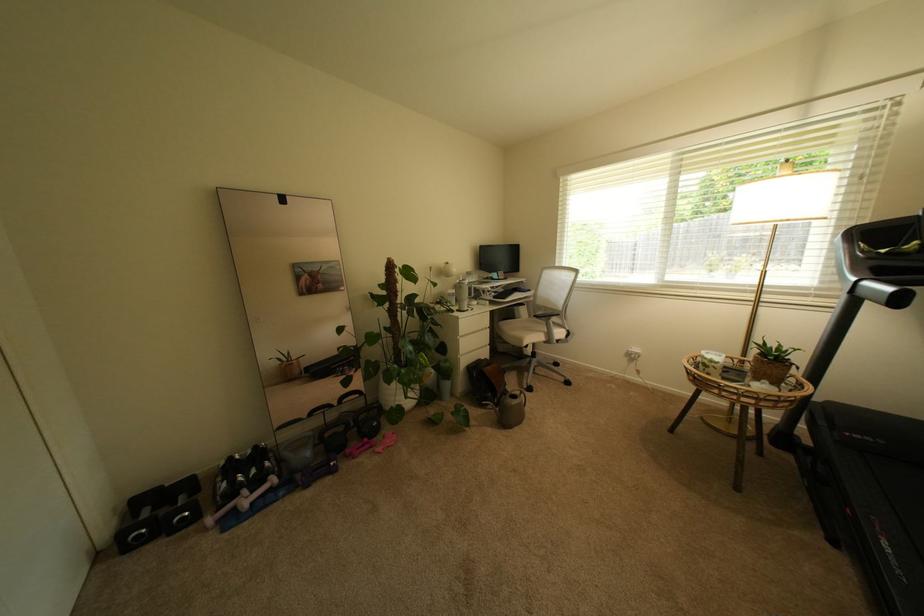
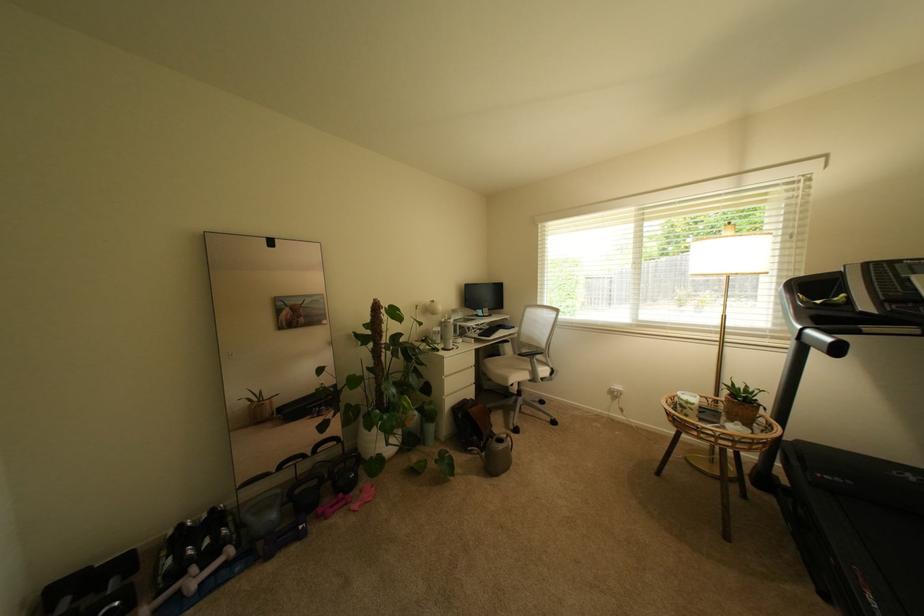
The point at [383,440] is marked in the first image. Where is the corresponding point in the second image?

(359, 495)